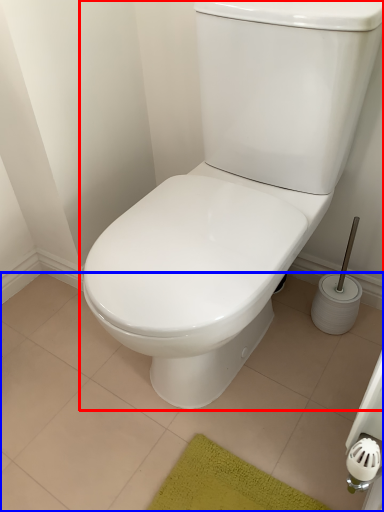
Question: Which object appears closest to the camera in this image, toilet (highlighted by a red box) or tile (highlighted by a blue box)?

Choices:
 (A) toilet
 (B) tile

Answer: (A)